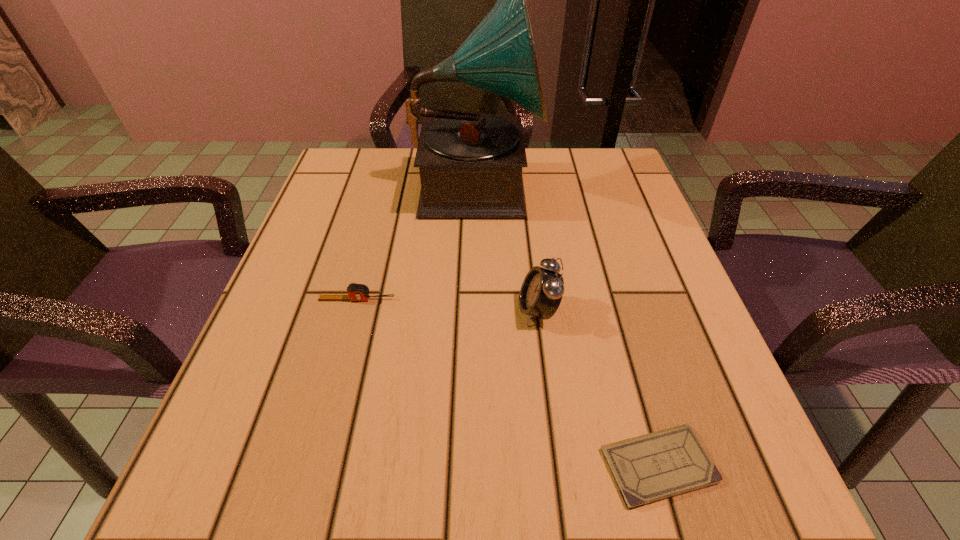
Find the location of a particular element. The height and width of the screenshot is (540, 960). the farthest object is located at coordinates (470, 164).

The width and height of the screenshot is (960, 540). I want to click on the tallest object, so click(x=470, y=164).

You are a GUI agent. You are given a task and a screenshot of the screen. Output one action in this format:
    pyautogui.click(x=<x>, y=<y>)
    Task: Click on the third shortest object
    
    Given the screenshot: What is the action you would take?
    pyautogui.click(x=542, y=290)

The width and height of the screenshot is (960, 540). What are the coordinates of `the third tallest object` in the screenshot? It's located at (356, 292).

You are a GUI agent. You are given a task and a screenshot of the screen. Output one action in this format:
    pyautogui.click(x=<x>, y=<y>)
    Task: Click on the rightmost object
    The image size is (960, 540).
    Given the screenshot: What is the action you would take?
    pyautogui.click(x=648, y=468)

Where is `checkbook`? The height and width of the screenshot is (540, 960). checkbook is located at coordinates (648, 468).

The width and height of the screenshot is (960, 540). In order to click on vacant space located on the horn of the tallest object in this screenshot , I will do `click(635, 185)`.

This screenshot has height=540, width=960. In order to click on free spot located 0.190m on the face of the second tallest object in this screenshot , I will do `click(409, 311)`.

Locate an element on the screen. free location located on the face of the second tallest object is located at coordinates 449,311.

This screenshot has height=540, width=960. Identify the location of blank area located on the face of the second tallest object. (380, 311).